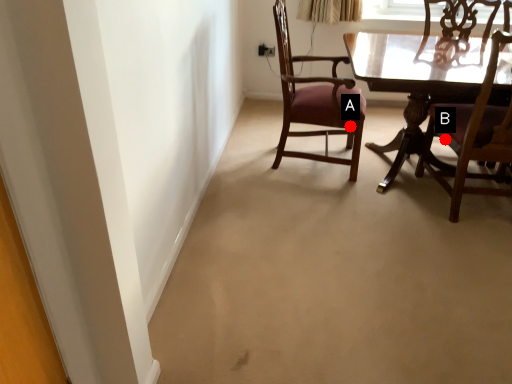
Question: Two points are circled on the image, labeled by A and B beside each circle. Which of the following is the farthest from the observer?

Choices:
 (A) A is further
 (B) B is further

Answer: (B)